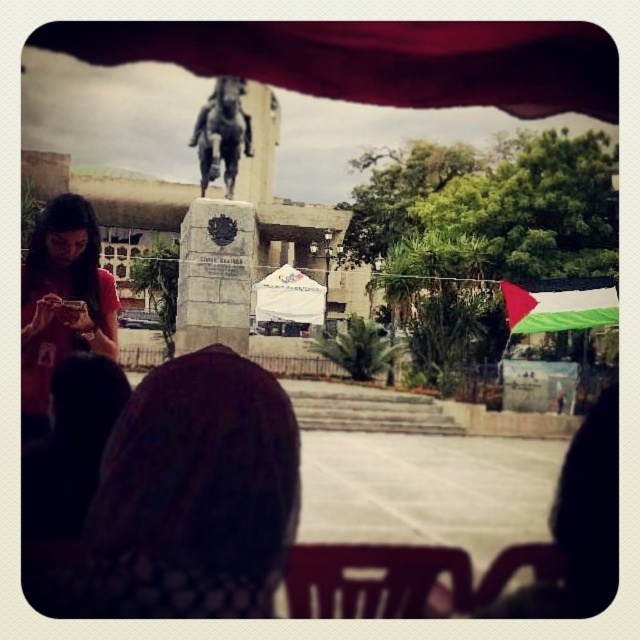
Does point (188, 412) come closer to viewer compared to point (214, 132)?

Yes, point (188, 412) is closer to viewer.

Which is in front, point (145, 540) or point (204, 186)?

Point (145, 540) is more forward.

At what (x,y) coordinates should I click in order to perform the action: click on brown textured hair at center. Please return your answer as a coordinate pair (x, y). This screenshot has height=640, width=640. Looking at the image, I should click on (195, 493).

You are a GUI agent. You are given a task and a screenshot of the screen. Output one action in this format:
    pyautogui.click(x=<x>, y=<y>)
    Task: Click on the brown textured hair at center
    The image size is (640, 640).
    Given the screenshot: What is the action you would take?
    pyautogui.click(x=195, y=493)

The height and width of the screenshot is (640, 640). What are the coordinates of `matte red shirt at lower left` in the screenshot? It's located at (61, 301).

Can you confirm if matte red shirt at lower left is wider than bronze statue at center?

Indeed, matte red shirt at lower left has a greater width compared to bronze statue at center.

Find the location of a particular element. matte red shirt at lower left is located at coordinates (61, 301).

Is matte red umbrella at upper center to the left of bronze statue at center from the viewer's perspective?

No, matte red umbrella at upper center is not to the left of bronze statue at center.

At what (x,y) coordinates should I click in order to perform the action: click on matte red umbrella at upper center. Please return your answer as a coordinate pair (x, y). The height and width of the screenshot is (640, 640). Looking at the image, I should click on (376, 58).

Between point (401, 60) and point (208, 148), which one is positioned behind?

Point (401, 60)

In order to click on matte red umbrella at upper center in this screenshot , I will do `click(376, 58)`.